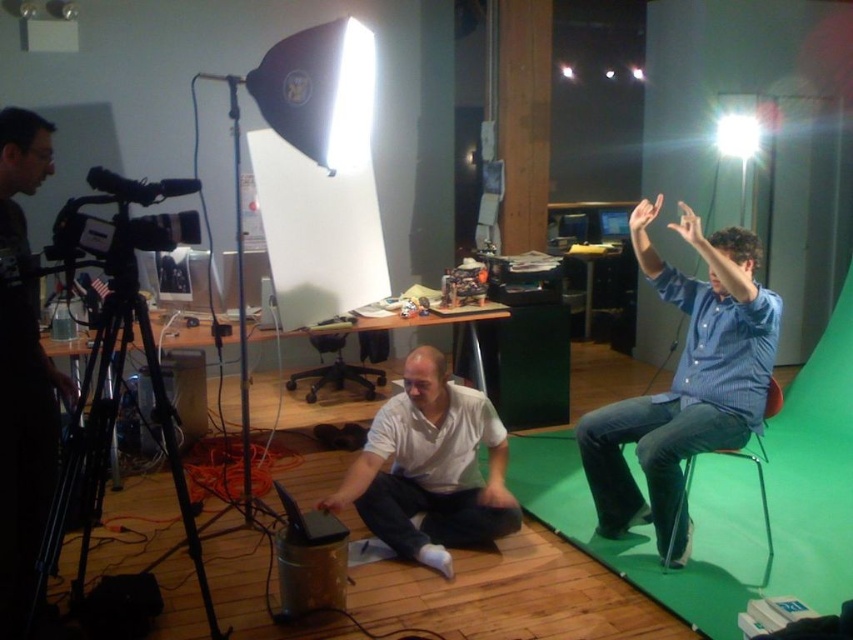
Which is more to the right, black matte camera at left or matte black monitor at upper center?

matte black monitor at upper center

Which is in front, point (7, 401) or point (622, 212)?

Point (7, 401)

Where is `black matte camera at left`? The width and height of the screenshot is (853, 640). black matte camera at left is located at coordinates (22, 445).

Looking at this image, can you confirm if blue striped shirt at right is positioned above matte black monitor at upper center?

No.

Does blue striped shirt at right have a lesser height compared to matte black monitor at upper center?

In fact, blue striped shirt at right may be taller than matte black monitor at upper center.

At what (x,y) coordinates should I click in order to perform the action: click on blue striped shirt at right. Please return your answer as a coordinate pair (x, y). Looking at the image, I should click on (685, 378).

Who is higher up, metallic silver chair at right or matte black monitor at upper center?

matte black monitor at upper center

Between metallic silver chair at right and matte black monitor at upper center, which one has more height?

metallic silver chair at right

Which is in front, point (772, 388) or point (602, 234)?

Point (772, 388)

In order to click on metallic silver chair at right in this screenshot , I will do `click(758, 484)`.